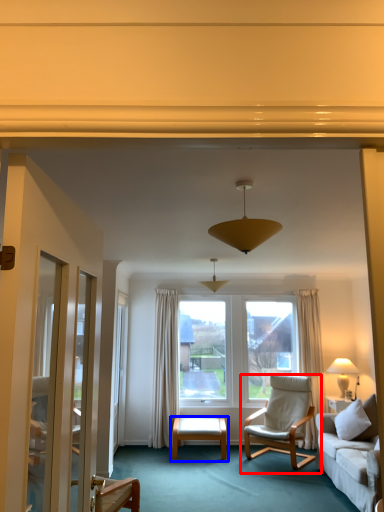
Question: Which point is further to the camera, chair (highlighted by a red box) or table (highlighted by a blue box)?

Choices:
 (A) chair
 (B) table

Answer: (B)